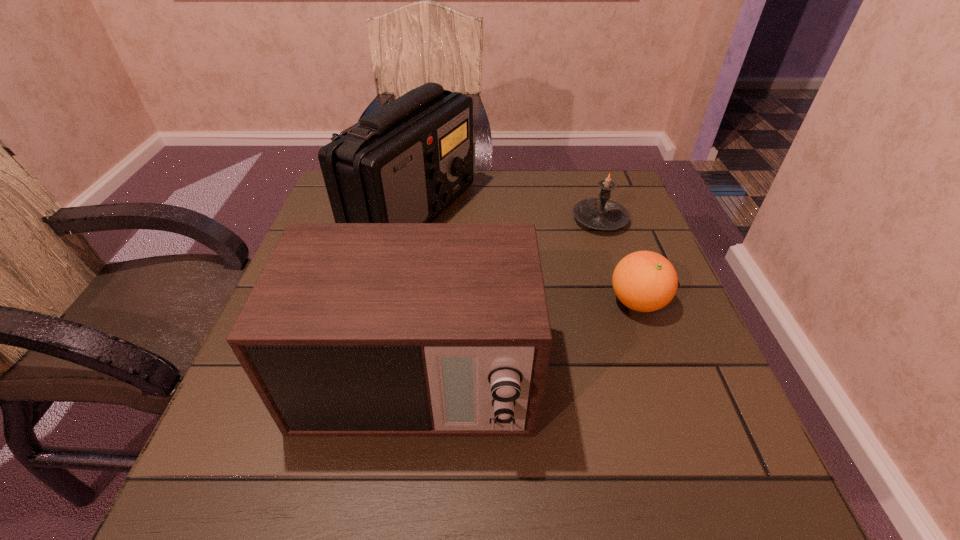
This screenshot has height=540, width=960. What are the coordinates of `free location at the far right corner` in the screenshot? It's located at (637, 204).

Identify the location of free space between the candle and the tallest object. (506, 216).

Find the location of a particular element. This screenshot has width=960, height=540. unoccupied area between the orange and the candle is located at coordinates (618, 261).

Where is `vacant space in between the candle and the orange`? Image resolution: width=960 pixels, height=540 pixels. vacant space in between the candle and the orange is located at coordinates (618, 261).

Identify the location of object that can be found as the third closest to the shorter radio receiver. The width and height of the screenshot is (960, 540). (601, 213).

Identify the location of object that ranks as the closest to the shorter radio receiver. (406, 162).

What are the coordinates of `vacant space that satisfies the following two spatial constraints: 1. on the front panel of the farther radio receiver; 2. on the left side of the orange` in the screenshot? It's located at (396, 302).

At what (x,y) coordinates should I click in order to perform the action: click on vacant area in the image that satisfies the following two spatial constraints: 1. on the front panel of the candle; 2. on the left side of the tallest object. Please return your answer as a coordinate pair (x, y). Looking at the image, I should click on (412, 220).

Find the location of a particular element. Image resolution: width=960 pixels, height=540 pixels. vacant space that satisfies the following two spatial constraints: 1. on the front panel of the tallest object; 2. on the right side of the candle is located at coordinates (412, 220).

Where is `free space that satisfies the following two spatial constraints: 1. on the back side of the orange; 2. on the front panel of the tallest object`? The width and height of the screenshot is (960, 540). free space that satisfies the following two spatial constraints: 1. on the back side of the orange; 2. on the front panel of the tallest object is located at coordinates (605, 212).